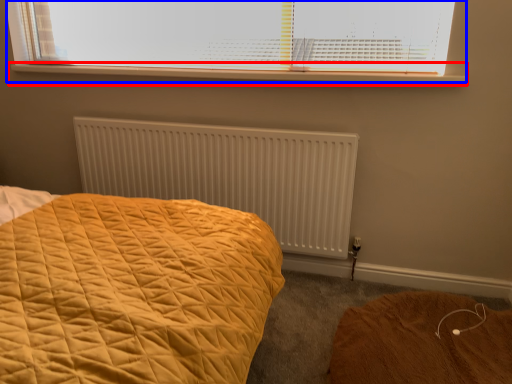
Question: Which object is further to the camera taking this photo, window sill (highlighted by a red box) or window (highlighted by a blue box)?

Choices:
 (A) window sill
 (B) window

Answer: (A)